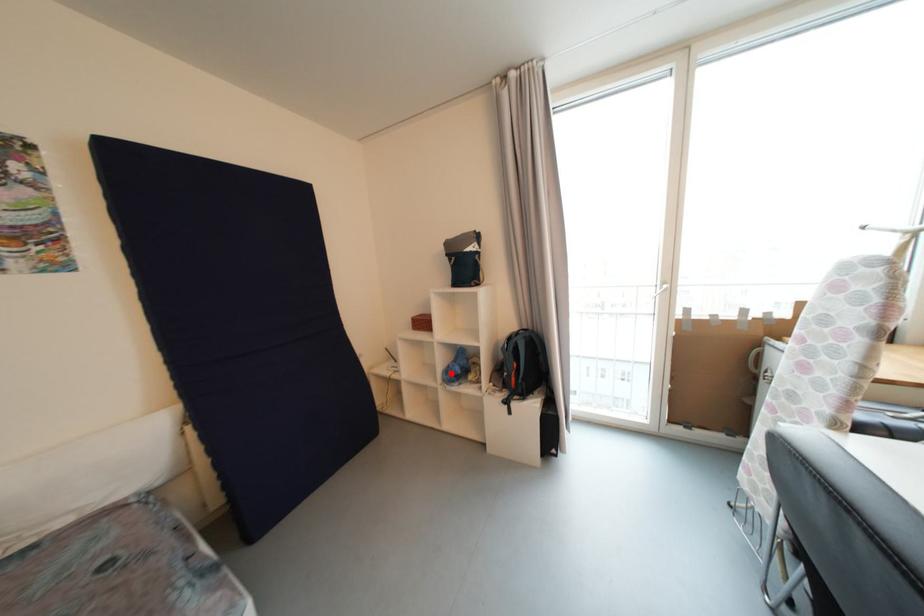
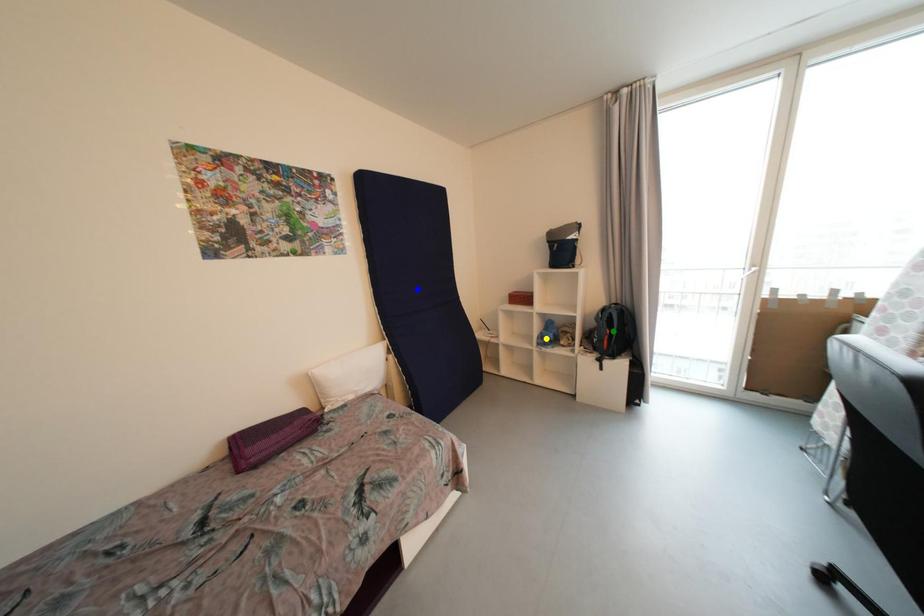
Question: I am providing you with two images of the same scene from different viewpoints. A red point is marked on the first image. You are given multiple points on the second image. Which spot in image 2 lines up with the point in image 1?

Choices:
 (A) blue point
 (B) green point
 (C) yellow point

Answer: (C)